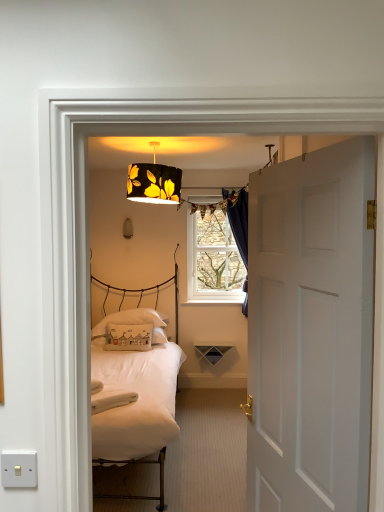
Question: From the image's perspective, is dark blue velvet curtain at upper center located beneath white cotton pillow at center, which ranks as the 1th pillow in front-to-back order?

Choices:
 (A) yes
 (B) no

Answer: (B)

Question: Is white cotton pillow at center, the second pillow when ordered from back to front, surrounded by dark blue velvet curtain at upper center?

Choices:
 (A) yes
 (B) no

Answer: (B)

Question: Is dark blue velvet curtain at upper center far from white cotton pillow at center, which ranks as the 1th pillow in front-to-back order?

Choices:
 (A) yes
 (B) no

Answer: (A)

Question: Could you tell me if dark blue velvet curtain at upper center is facing white cotton pillow at center, which ranks as the 1th pillow in front-to-back order?

Choices:
 (A) no
 (B) yes

Answer: (A)

Question: Is dark blue velvet curtain at upper center positioned with its back to white cotton pillow at center, which ranks as the 1th pillow in front-to-back order?

Choices:
 (A) yes
 (B) no

Answer: (B)

Question: From their relative heights in the image, would you say black fabric lampshade at upper center, the second lamp when ordered from front to back, is taller or shorter than white matte door at right?

Choices:
 (A) tall
 (B) short

Answer: (B)

Question: Visually, is black fabric lampshade at upper center, the second lamp when ordered from front to back, positioned to the left or to the right of white matte door at right?

Choices:
 (A) right
 (B) left

Answer: (B)

Question: Is black fabric lampshade at upper center, which is counted as the second lamp, starting from the top, in front of or behind white matte door at right in the image?

Choices:
 (A) front
 (B) behind

Answer: (B)

Question: Would you say black fabric lampshade at upper center, the 2th lamp positioned from the right, is inside or outside white matte door at right?

Choices:
 (A) outside
 (B) inside

Answer: (A)

Question: Is dark blue velvet curtain at upper center situated inside white cotton pillow at center, which ranks as the 1th pillow in front-to-back order, or outside?

Choices:
 (A) outside
 (B) inside

Answer: (A)

Question: In terms of size, does dark blue velvet curtain at upper center appear bigger or smaller than white cotton pillow at center, the second pillow when ordered from back to front?

Choices:
 (A) small
 (B) big

Answer: (B)

Question: Is dark blue velvet curtain at upper center to the left or to the right of white cotton pillow at center, the second pillow when ordered from back to front, in the image?

Choices:
 (A) left
 (B) right

Answer: (B)

Question: Is point (243, 249) closer or farther from the camera than point (142, 349)?

Choices:
 (A) closer
 (B) farther

Answer: (B)

Question: Is point (243, 187) positioned closer to the camera than point (322, 337)?

Choices:
 (A) closer
 (B) farther

Answer: (B)

Question: Considering the positions of dark blue velvet curtain at upper center and white matte door at right in the image, is dark blue velvet curtain at upper center taller or shorter than white matte door at right?

Choices:
 (A) short
 (B) tall

Answer: (A)